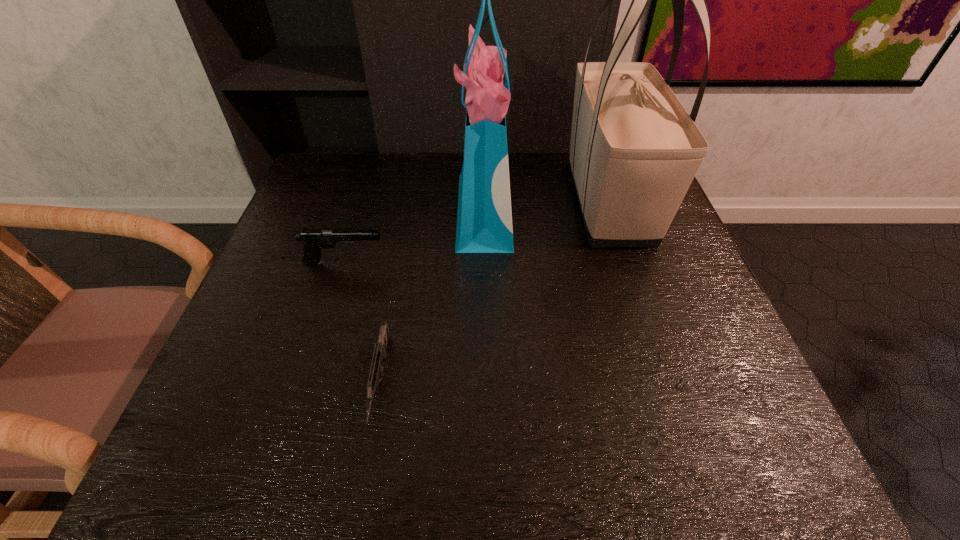
Find the location of a particular element. blank space that satisfies the following two spatial constraints: 1. with handles facing forward on the rightmost object; 2. at the aiming end of the second shortest object is located at coordinates (629, 262).

Find the location of a particular element. This screenshot has height=540, width=960. vacant point that satisfies the following two spatial constraints: 1. with handles facing forward on the right shopping bag; 2. at the aiming end of the taller gun is located at coordinates (629, 262).